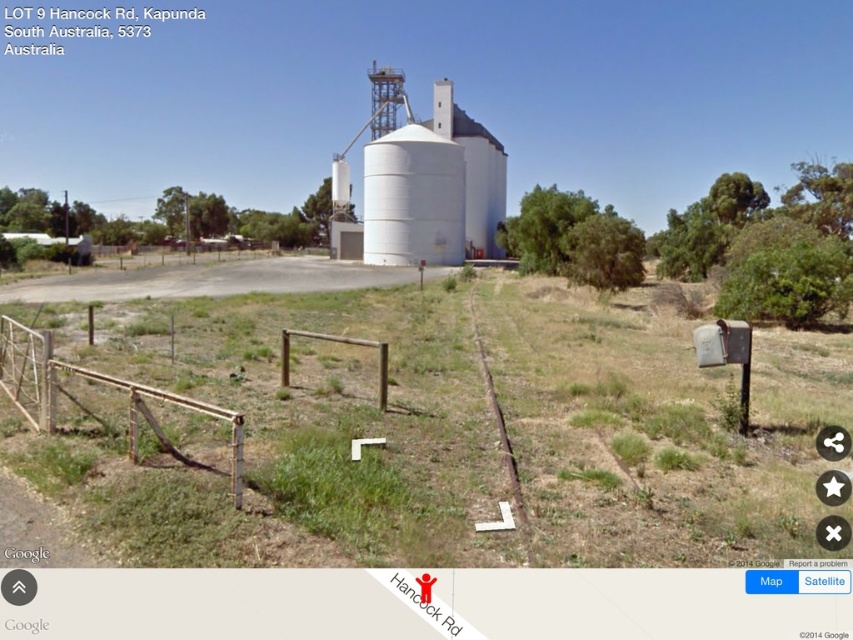
Question: Among these points, which one is farthest from the camera?

Choices:
 (A) (35, 365)
 (B) (434, 262)
 (C) (387, 198)

Answer: (B)

Question: Which object appears farthest from the camera in this image?

Choices:
 (A) white smooth silo at center
 (B) white matte silo at center
 (C) brown wooden fence at left

Answer: (A)

Question: Observing the image, what is the correct spatial positioning of white smooth silo at center in reference to brown wooden fence at left?

Choices:
 (A) left
 (B) right

Answer: (A)

Question: Does white smooth silo at center have a lesser width compared to brown wooden fence at left?

Choices:
 (A) yes
 (B) no

Answer: (B)

Question: From the image, what is the correct spatial relationship of white smooth silo at center in relation to white matte silo at center?

Choices:
 (A) above
 (B) below

Answer: (A)

Question: Which of these objects is positioned closest to the white matte silo at center?

Choices:
 (A) brown wooden fence at left
 (B) white smooth silo at center

Answer: (B)